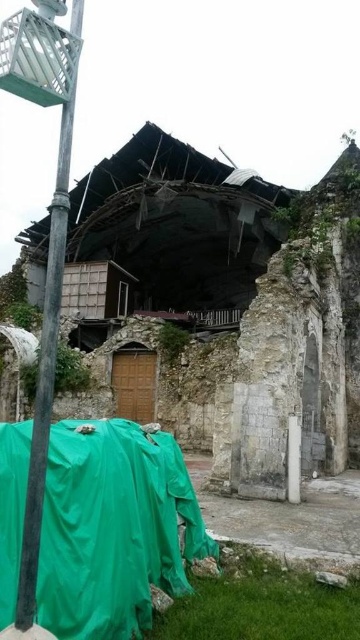
Question: Does green tarpaulin at lower left appear over metallic pole at left?

Choices:
 (A) yes
 (B) no

Answer: (B)

Question: Which of the following is the closest to the observer?

Choices:
 (A) (46, 326)
 (B) (145, 486)

Answer: (A)

Question: Does green tarpaulin at lower left lie behind metallic pole at left?

Choices:
 (A) yes
 (B) no

Answer: (A)

Question: Does green tarpaulin at lower left have a smaller size compared to metallic pole at left?

Choices:
 (A) no
 (B) yes

Answer: (B)

Question: Which point is closer to the camera taking this photo?

Choices:
 (A) 87,529
 (B) 61,132

Answer: (A)

Question: Which point appears farthest from the camera in this image?

Choices:
 (A) pyautogui.click(x=57, y=177)
 (B) pyautogui.click(x=131, y=612)

Answer: (A)